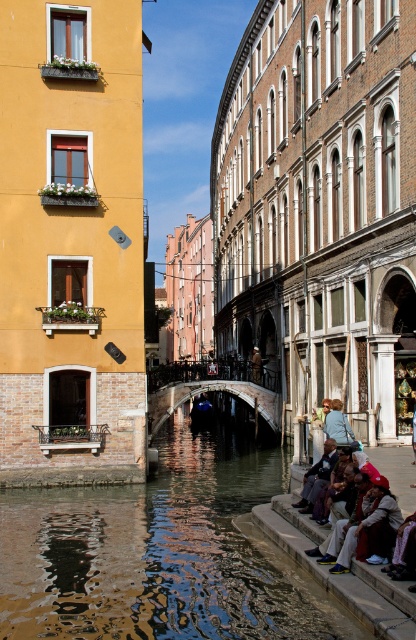
Question: Is smooth stone ledge at lower right behind light blue fabric jacket at lower right?

Choices:
 (A) no
 (B) yes

Answer: (A)

Question: Which point is farther to the camera?

Choices:
 (A) (302, 540)
 (B) (334, 404)

Answer: (B)

Question: Can you confirm if smooth stone ledge at lower right is thinner than light blue fabric jacket at lower right?

Choices:
 (A) yes
 (B) no

Answer: (B)

Question: Among these points, which one is nearest to the camera?

Choices:
 (A) (314, 540)
 (B) (326, 428)

Answer: (A)

Question: Can you confirm if smooth stone ledge at lower right is smaller than light blue fabric jacket at lower right?

Choices:
 (A) yes
 (B) no

Answer: (B)